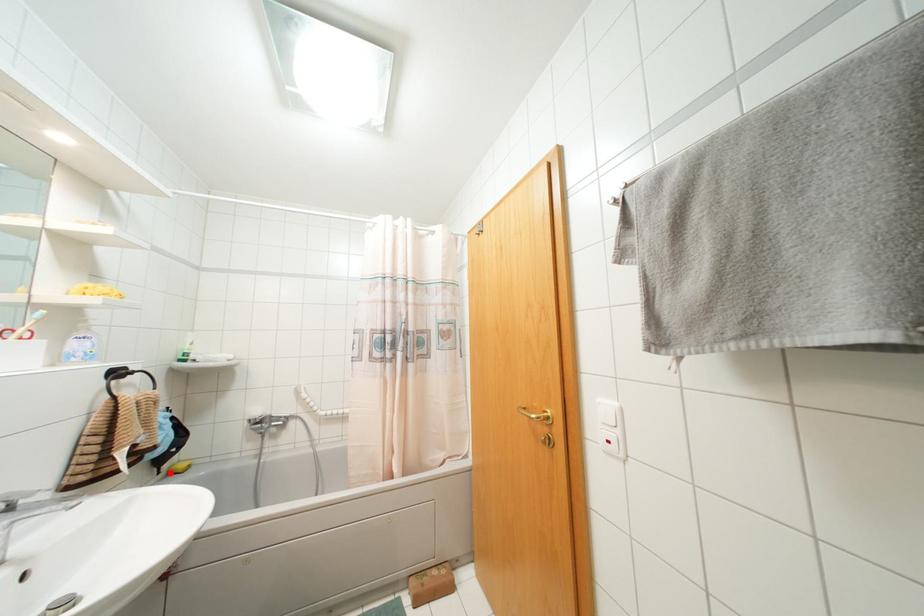
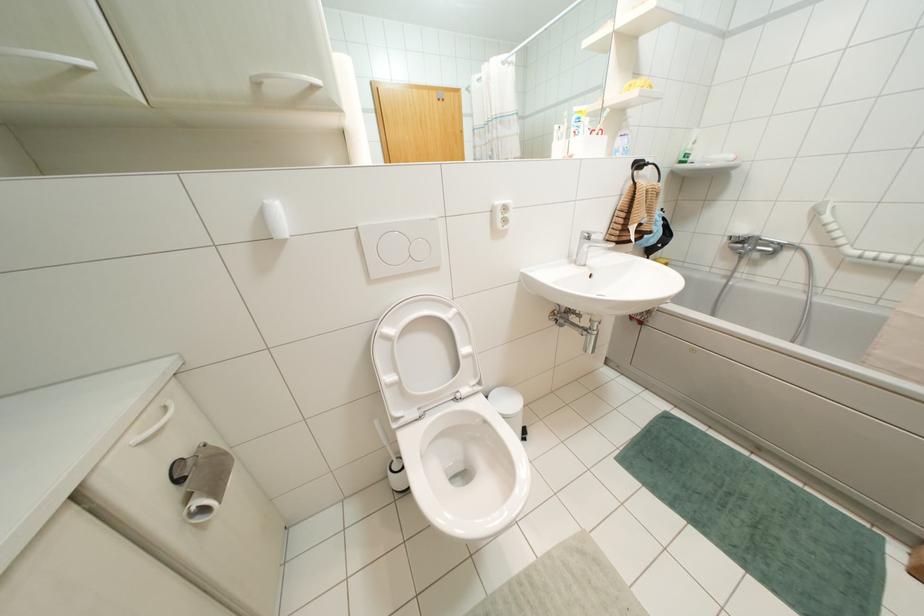
Question: I am providing you with two images of the same scene from different viewpoints. A red point is marked on the first image. Can you still see the location of the red point in image 2?

Choices:
 (A) Yes
 (B) No

Answer: (B)